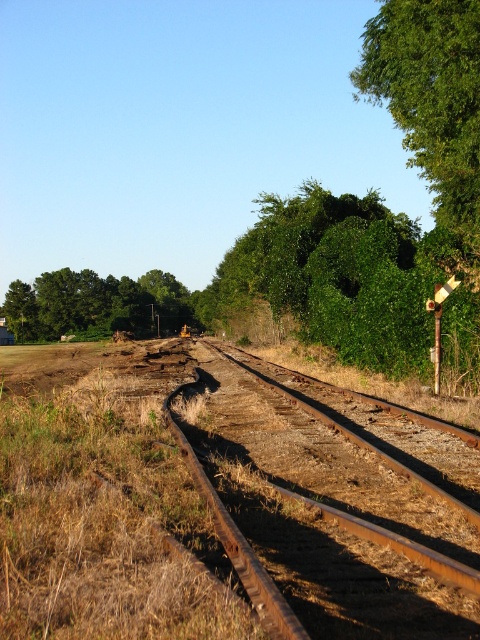
Question: Can you confirm if rusty metal train track at center is positioned to the left of green leafy tree at upper left?

Choices:
 (A) no
 (B) yes

Answer: (A)

Question: Based on their relative distances, which object is farther from the rusty metal pole at right?

Choices:
 (A) green leafy tree at upper left
 (B) rusty metal train track at center

Answer: (A)

Question: Which point is farther to the camera?

Choices:
 (A) green leafy tree at upper left
 (B) rusty metal pole at right
 (C) rusty metal train track at center

Answer: (A)

Question: Is green leafy tree at upper left above rusty metal pole at right?

Choices:
 (A) yes
 (B) no

Answer: (A)

Question: Is green leafy tree at upper left to the left of rusty metal pole at right from the viewer's perspective?

Choices:
 (A) yes
 (B) no

Answer: (A)

Question: Which object appears farthest from the camera in this image?

Choices:
 (A) rusty metal train track at center
 (B) green leafy tree at upper left

Answer: (B)